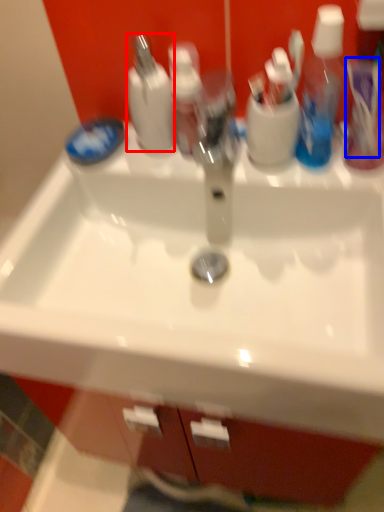
Question: Which object appears farthest to the camera in this image, cleaning product (highlighted by a red box) or toothbrush (highlighted by a blue box)?

Choices:
 (A) cleaning product
 (B) toothbrush

Answer: (A)